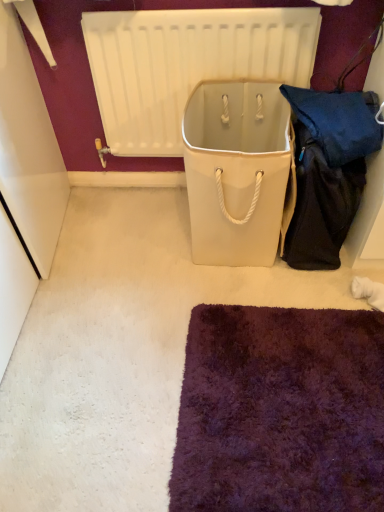
Question: From a real-world perspective, does white matte radiator at upper center stand above white canvas cooler at center?

Choices:
 (A) no
 (B) yes

Answer: (B)

Question: Can you confirm if white matte radiator at upper center is shorter than white canvas cooler at center?

Choices:
 (A) no
 (B) yes

Answer: (A)

Question: Is white canvas cooler at center surrounded by white matte radiator at upper center?

Choices:
 (A) no
 (B) yes

Answer: (A)

Question: Considering the relative sizes of white matte radiator at upper center and white canvas cooler at center in the image provided, is white matte radiator at upper center smaller than white canvas cooler at center?

Choices:
 (A) no
 (B) yes

Answer: (B)

Question: From the image's perspective, is white matte radiator at upper center over white canvas cooler at center?

Choices:
 (A) yes
 (B) no

Answer: (A)

Question: Is white matte radiator at upper center positioned behind white canvas cooler at center?

Choices:
 (A) no
 (B) yes

Answer: (B)

Question: Is white canvas cooler at center completely or partially outside of white matte radiator at upper center?

Choices:
 (A) no
 (B) yes

Answer: (B)

Question: Can you confirm if white canvas cooler at center is positioned to the right of white matte radiator at upper center?

Choices:
 (A) no
 (B) yes

Answer: (B)

Question: Considering the relative sizes of white canvas cooler at center and white matte radiator at upper center in the image provided, is white canvas cooler at center smaller than white matte radiator at upper center?

Choices:
 (A) yes
 (B) no

Answer: (B)

Question: Is white canvas cooler at center oriented towards white matte radiator at upper center?

Choices:
 (A) yes
 (B) no

Answer: (B)

Question: From the image's perspective, would you say white canvas cooler at center is positioned over white matte radiator at upper center?

Choices:
 (A) yes
 (B) no

Answer: (B)

Question: Is white canvas cooler at center further to camera compared to white matte radiator at upper center?

Choices:
 (A) yes
 (B) no

Answer: (B)

Question: Is point (107, 124) closer or farther from the camera than point (284, 120)?

Choices:
 (A) farther
 (B) closer

Answer: (A)